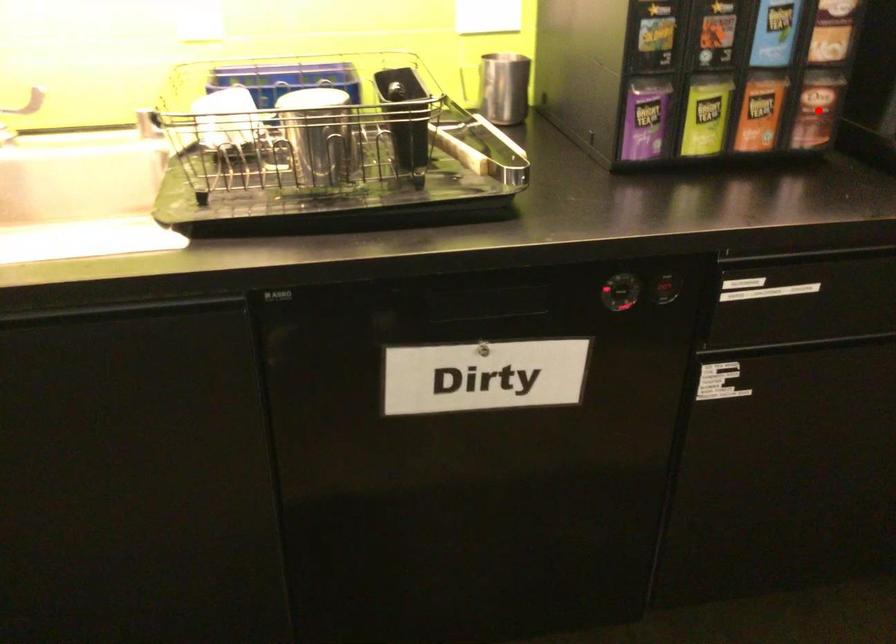
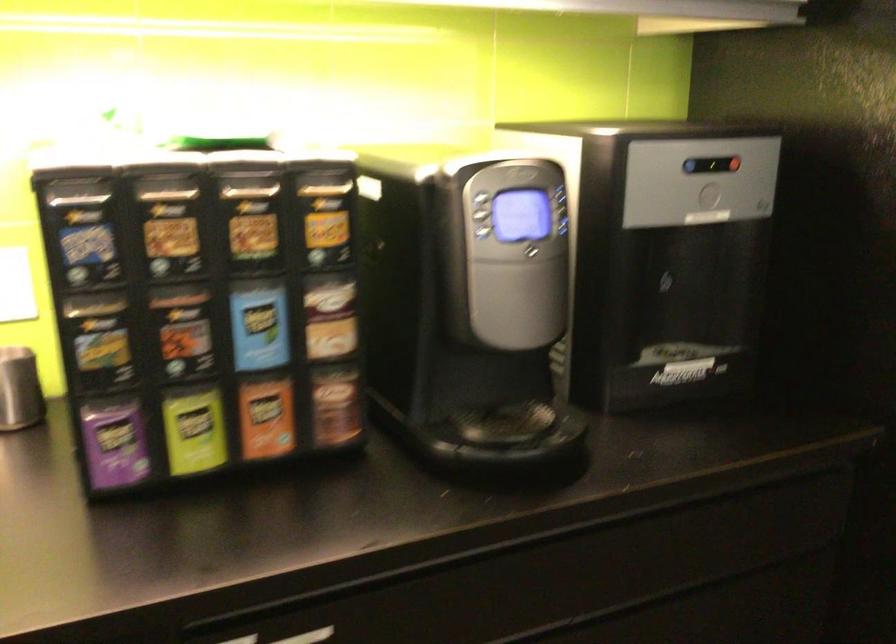
The point at the highlighted location is marked in the first image. Where is the corresponding point in the second image?

(336, 406)